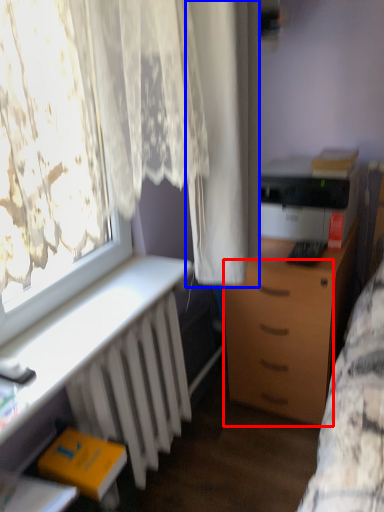
Question: Which point is closer to the camera, drawer (highlighted by a red box) or curtain (highlighted by a blue box)?

Choices:
 (A) drawer
 (B) curtain

Answer: (B)